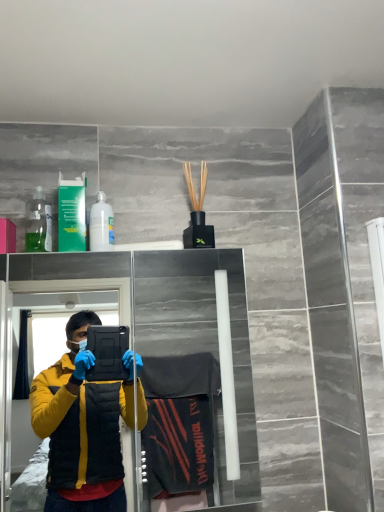
Question: Are transparent plastic bottle at upper left and white matte bottle at upper left located far from each other?

Choices:
 (A) yes
 (B) no

Answer: (B)

Question: Could you tell me if transparent plastic bottle at upper left is turned towards white matte bottle at upper left?

Choices:
 (A) yes
 (B) no

Answer: (B)

Question: Does transparent plastic bottle at upper left appear on the left side of white matte bottle at upper left?

Choices:
 (A) no
 (B) yes

Answer: (B)

Question: Is transparent plastic bottle at upper left positioned with its back to white matte bottle at upper left?

Choices:
 (A) no
 (B) yes

Answer: (A)

Question: Considering the relative sizes of transparent plastic bottle at upper left and white matte bottle at upper left in the image provided, is transparent plastic bottle at upper left bigger than white matte bottle at upper left?

Choices:
 (A) yes
 (B) no

Answer: (A)

Question: Is point (102, 232) closer or farther from the camera than point (33, 206)?

Choices:
 (A) farther
 (B) closer

Answer: (B)

Question: Based on their positions, is white matte bottle at upper left located to the left or right of transparent plastic bottle at upper left?

Choices:
 (A) right
 (B) left

Answer: (A)

Question: Looking at their shapes, would you say white matte bottle at upper left is wider or thinner than transparent plastic bottle at upper left?

Choices:
 (A) thin
 (B) wide

Answer: (B)

Question: In the image, is white matte bottle at upper left positioned in front of or behind transparent plastic bottle at upper left?

Choices:
 (A) front
 (B) behind

Answer: (A)

Question: Considering the positions of transparent plastic bottle at upper left and white matte bottle at upper left in the image, is transparent plastic bottle at upper left taller or shorter than white matte bottle at upper left?

Choices:
 (A) tall
 (B) short

Answer: (A)

Question: Is transparent plastic bottle at upper left to the left or to the right of white matte bottle at upper left in the image?

Choices:
 (A) left
 (B) right

Answer: (A)

Question: Relative to white matte bottle at upper left, is transparent plastic bottle at upper left in front or behind?

Choices:
 (A) front
 (B) behind

Answer: (B)

Question: From a real-world perspective, is transparent plastic bottle at upper left above or below white matte bottle at upper left?

Choices:
 (A) above
 (B) below

Answer: (A)

Question: Is point (243, 498) closer or farther from the camera than point (46, 242)?

Choices:
 (A) farther
 (B) closer

Answer: (A)

Question: Is transparent glass door at upper center inside or outside of transparent plastic bottle at upper left?

Choices:
 (A) inside
 (B) outside

Answer: (B)